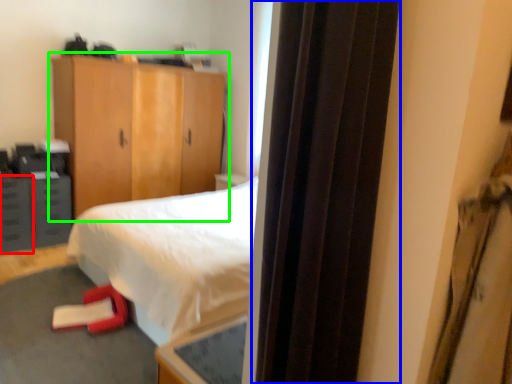
Question: Based on their relative distances, which object is nearer to drawer (highlighted by a red box)? Choose from screen door (highlighted by a blue box) and cupboard (highlighted by a green box).

Choices:
 (A) screen door
 (B) cupboard

Answer: (B)